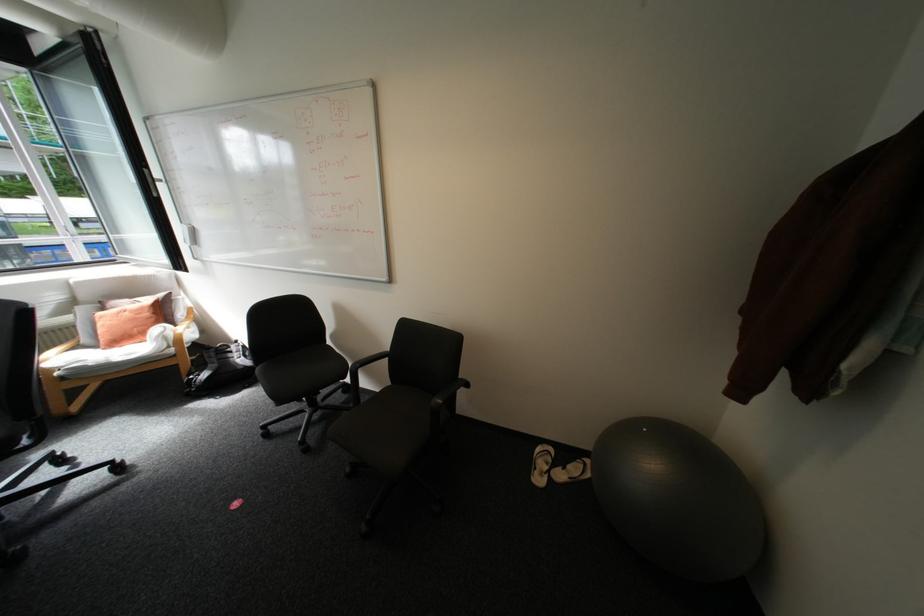
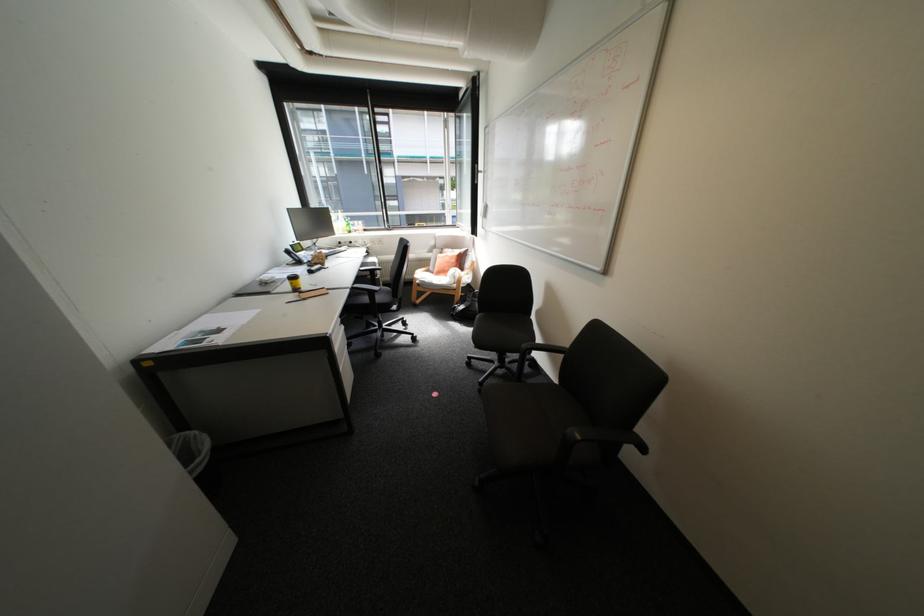
The point at (311, 442) is marked in the first image. Where is the corresponding point in the second image?

(491, 384)